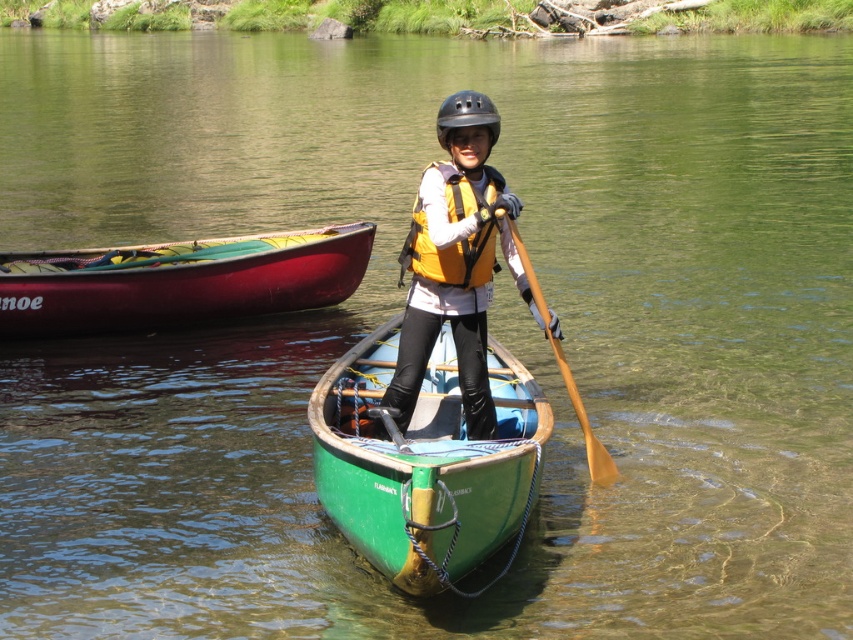
You are in a boat on the water and see two points marked on the map. The first point is at coordinate point(402,422) and the second is at point(558,355). According to the scene description, which point is closer to you?

Point(402,422) is in front of point(558,355), so it is closer to you.

You are a safety inspector checking the gear of the person in the green canoe. You notice the yellow matte life jacket at center and the black matte helmet at center. Which piece of safety gear is larger in size?

The black matte helmet at center is larger than the yellow matte life jacket at center, so the helmet is the larger piece of safety gear.

You are a lifeguard on duty and see the image. There is a point at coordinates (456, 260). What object is located at this point?

The point at coordinates (456, 260) corresponds to the yellow life vest at center.